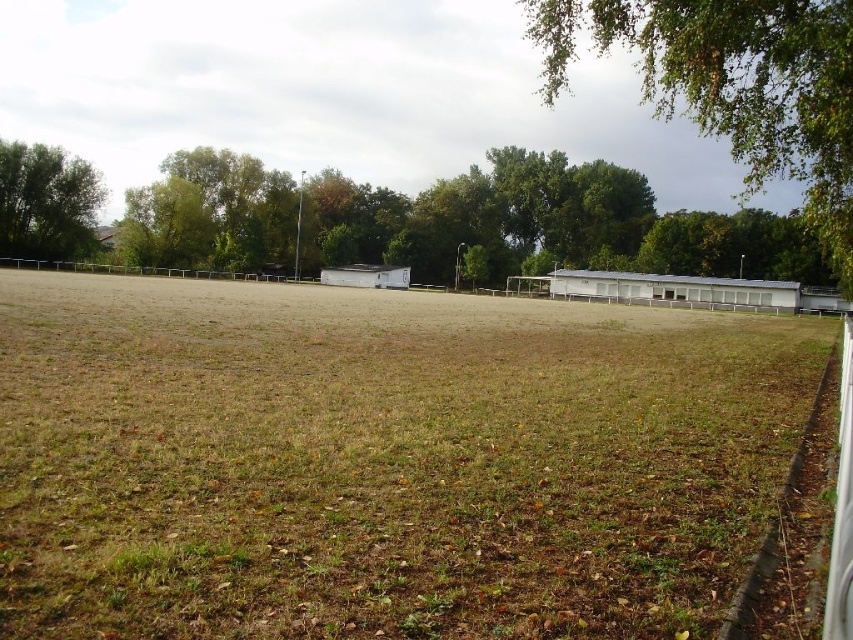
Question: Among these objects, which one is farthest from the camera?

Choices:
 (A) green leafy tree at left
 (B) brown grass at center

Answer: (A)

Question: Does green leafy tree at upper right have a lesser width compared to green leafy tree at left?

Choices:
 (A) yes
 (B) no

Answer: (B)

Question: Which object appears farthest from the camera in this image?

Choices:
 (A) green leafy tree at upper right
 (B) brown grass at center

Answer: (A)

Question: In this image, where is green leafy tree at upper right located relative to green leafy tree at left?

Choices:
 (A) above
 (B) below

Answer: (A)

Question: Which is farther from the green leafy tree at left?

Choices:
 (A) brown grass at center
 (B) green leafy tree at upper right

Answer: (B)

Question: Is brown grass at center bigger than green leafy tree at left?

Choices:
 (A) yes
 (B) no

Answer: (A)